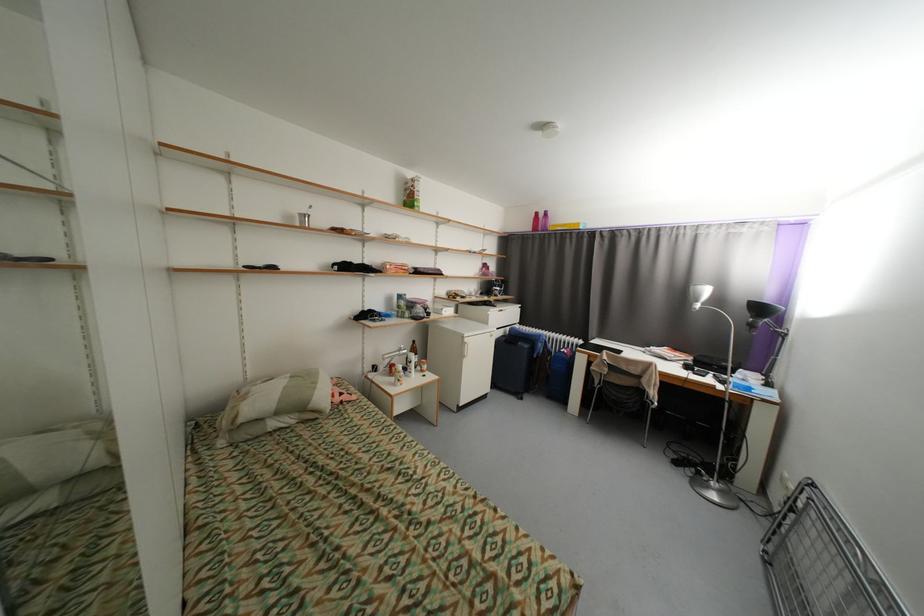
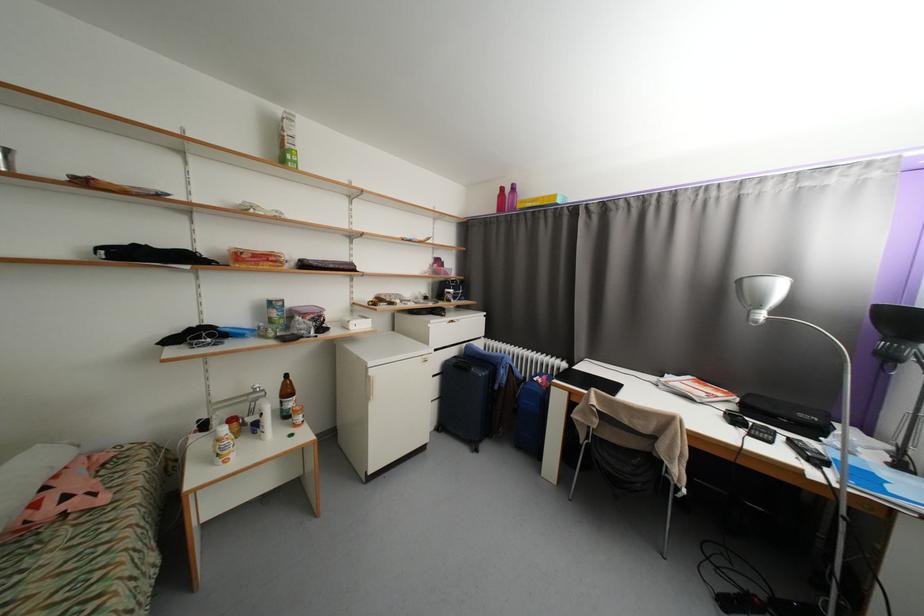
Where in the second image is the point corresponding to point 542,215 from the first image?

(508, 190)